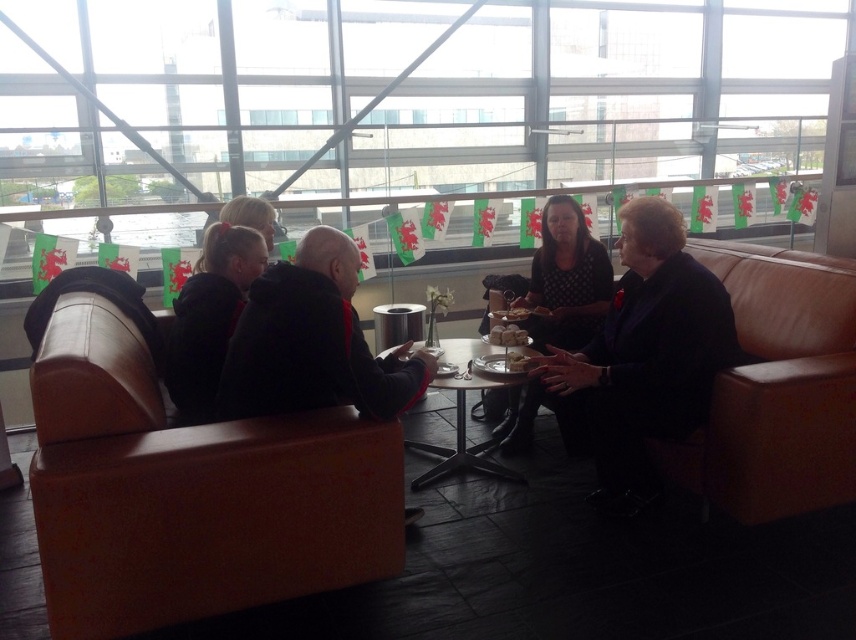
You are sitting at the table and want to move to the brown leather couch at left and the brown leather couch at right. Which couch is closer to the table?

The brown leather couch at left is closer to the table because it is positioned below the brown leather couch at right, meaning it is closer to the table.

You are sitting at the table and want to move to the brown leather couch at left without walking behind the brown leather couch at right. Is this possible?

The brown leather couch at left is in front of the brown leather couch at right, so you can move to the brown leather couch at left without walking behind the brown leather couch at right.

In the scene shown: You are standing in the room and want to place a small object on the table. There are two points marked on the table where you can place it. Which point is closer to you, point (568, 424) or point (556, 314)?

Point (568, 424) is closer to the viewer than point (556, 314), so you should place the object there.